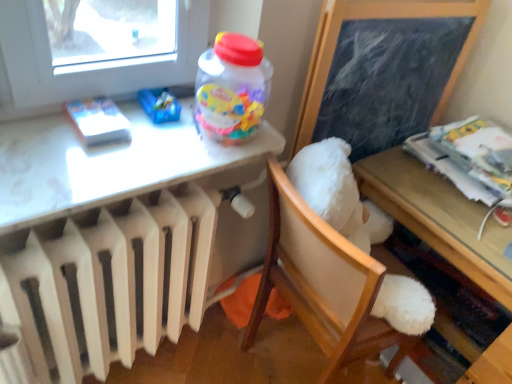
What do you see at coordinates (460, 161) in the screenshot? I see `printed paper stack at right, which is the second magazine in front-to-back order` at bounding box center [460, 161].

Where is `white plush chair at center`? white plush chair at center is located at coordinates (322, 283).

What is the approximate width of white matte book at upper left, placed as the 2th magazine when sorted from right to left?

white matte book at upper left, placed as the 2th magazine when sorted from right to left, is 6.42 inches wide.

What is the approximate height of black chalkboard at upper right?

The height of black chalkboard at upper right is 51.75 centimeters.

Describe the element at coordinates (108, 232) in the screenshot. I see `white plastic radiator at lower left` at that location.

The width and height of the screenshot is (512, 384). What are the coordinates of `white plastic radiator at lower left` in the screenshot? It's located at [x=108, y=232].

From the picture: How much space does white glossy table at upper left, which appears as the 2th table when viewed from the right, occupy vertically?

The height of white glossy table at upper left, which appears as the 2th table when viewed from the right, is 2.96 inches.

Locate an element on the screen. This screenshot has width=512, height=384. white glossy table at upper left, which ranks as the first table in left-to-right order is located at coordinates (106, 163).

This screenshot has height=384, width=512. I want to click on wooden table at lower right, the 1th table viewed from the right, so click(435, 215).

Locate an element on the screen. printed paper stack at right, placed as the second magazine when sorted from left to right is located at coordinates pos(460,161).

Is white matte book at upper left, marked as the first magazine in a front-to-back arrangement, thinner than white plastic radiator at lower left?

Indeed, white matte book at upper left, marked as the first magazine in a front-to-back arrangement, has a lesser width compared to white plastic radiator at lower left.

Which point is more forward, (x=105, y=101) or (x=6, y=314)?

The point (x=6, y=314) is closer to the camera.

Is white matte book at upper left, placed as the 1th magazine when sorted from left to right, far away from white plastic radiator at lower left?

white matte book at upper left, placed as the 1th magazine when sorted from left to right, is near white plastic radiator at lower left, not far away.

From a real-world perspective, does white matte book at upper left, placed as the 2th magazine when sorted from right to left, sit lower than white plastic radiator at lower left?

Actually, white matte book at upper left, placed as the 2th magazine when sorted from right to left, is physically above white plastic radiator at lower left in the real world.

Is white plastic radiator at lower left positioned with its back to white plush chair at center?

No, white plastic radiator at lower left is not facing away from white plush chair at center.

Can you see white plastic radiator at lower left touching white plush chair at center?

No, white plastic radiator at lower left is not next to white plush chair at center.

Considering the relative positions of white plastic radiator at lower left and white plush chair at center in the image provided, is white plastic radiator at lower left to the left or to the right of white plush chair at center?

In the image, white plastic radiator at lower left appears on the left side of white plush chair at center.

From the image's perspective, between white plastic radiator at lower left and white plush chair at center, which one is located above?

white plush chair at center, from the image's perspective.

How many degrees apart are the facing directions of white glossy table at upper left, which ranks as the first table in left-to-right order, and white plush chair at center?

There is a 90-degree angle between the facing directions of white glossy table at upper left, which ranks as the first table in left-to-right order, and white plush chair at center.

Is there a large distance between white glossy table at upper left, which ranks as the first table in left-to-right order, and white plush chair at center?

They are positioned close to each other.

Can we say white glossy table at upper left, which ranks as the first table in left-to-right order, lies outside white plush chair at center?

Yes.

Is point (2, 160) positioned in front of point (270, 259)?

Yes, point (2, 160) is in front of point (270, 259).

Can you confirm if white glossy table at upper left, which appears as the 2th table when viewed from the right, is wider than black chalkboard at upper right?

Correct, the width of white glossy table at upper left, which appears as the 2th table when viewed from the right, exceeds that of black chalkboard at upper right.

Does point (121, 162) come closer to viewer compared to point (447, 62)?

Yes.

Is white glossy table at upper left, which ranks as the first table in left-to-right order, turned away from black chalkboard at upper right?

No, white glossy table at upper left, which ranks as the first table in left-to-right order, is not facing the opposite direction of black chalkboard at upper right.

From the image's perspective, would you say printed paper stack at right, which ranks as the first magazine in right-to-left order, is positioned over white plush chair at center?

Yes, from the image's perspective, printed paper stack at right, which ranks as the first magazine in right-to-left order, is over white plush chair at center.

Considering the relative sizes of printed paper stack at right, placed as the second magazine when sorted from left to right, and white plush chair at center in the image provided, is printed paper stack at right, placed as the second magazine when sorted from left to right, smaller than white plush chair at center?

Yes.

Based on their positions, is printed paper stack at right, which ranks as the first magazine in right-to-left order, located to the left or right of white plush chair at center?

printed paper stack at right, which ranks as the first magazine in right-to-left order, is to the right of white plush chair at center.

Is printed paper stack at right, which is the second magazine in front-to-back order, further to camera compared to white plush chair at center?

Yes, printed paper stack at right, which is the second magazine in front-to-back order, is further from the camera.

From the image's perspective, is printed paper stack at right, which is the second magazine in front-to-back order, located above or below white glossy table at upper left, which appears as the 2th table when viewed from the right?

Based on their image positions, printed paper stack at right, which is the second magazine in front-to-back order, is located above white glossy table at upper left, which appears as the 2th table when viewed from the right.

Does point (502, 194) appear closer or farther from the camera than point (63, 175)?

Point (502, 194) appears to be farther away from the viewer than point (63, 175).

In the image, is printed paper stack at right, which is the second magazine in front-to-back order, on the left side or the right side of white glossy table at upper left, which appears as the 2th table when viewed from the right?

From the image, it's evident that printed paper stack at right, which is the second magazine in front-to-back order, is to the right of white glossy table at upper left, which appears as the 2th table when viewed from the right.

Is printed paper stack at right, which ranks as the first magazine in right-to-left order, wider than white glossy table at upper left, which appears as the 2th table when viewed from the right?

Yes.

From the image's perspective, would you say printed paper stack at right, which ranks as the 1th magazine in back-to-front order, is positioned over white matte book at upper left, the 2th magazine from the back?

No, from the image's perspective, printed paper stack at right, which ranks as the 1th magazine in back-to-front order, is not on top of white matte book at upper left, the 2th magazine from the back.

What's the angular difference between printed paper stack at right, which is the second magazine in front-to-back order, and white matte book at upper left, placed as the 1th magazine when sorted from left to right,'s facing directions?

They differ by 88.9 degrees in their facing directions.

From a real-world perspective, which object stands above the other?

white matte book at upper left, the 2th magazine from the back, is physically above.

This screenshot has width=512, height=384. What are the coordinates of `magazine on the left of printed paper stack at right, which ranks as the first magazine in right-to-left order` in the screenshot? It's located at (98, 121).

Which magazine is the 1st one when counting from the right side of the white plastic radiator at lower left? Please provide its 2D coordinates.

[(98, 121)]

Where is `chair in front of the white plastic radiator at lower left`? The height and width of the screenshot is (384, 512). chair in front of the white plastic radiator at lower left is located at coordinates pos(322,283).

Estimate the real-world distances between objects in this image. Which object is further from printed paper stack at right, which ranks as the first magazine in right-to-left order, white plastic radiator at lower left or wooden table at lower right, the 1th table viewed from the right?

white plastic radiator at lower left is further to printed paper stack at right, which ranks as the first magazine in right-to-left order.

Estimate the real-world distances between objects in this image. Which object is further from wooden table at lower right, which appears as the 2th table when viewed from the left, white plush chair at center or white matte book at upper left, placed as the 2th magazine when sorted from right to left?

white matte book at upper left, placed as the 2th magazine when sorted from right to left, is positioned further to the anchor wooden table at lower right, which appears as the 2th table when viewed from the left.

Considering their positions, is wooden table at lower right, the 1th table viewed from the right, positioned closer to printed paper stack at right, which is the second magazine in front-to-back order, than white plush chair at center?

wooden table at lower right, the 1th table viewed from the right, is positioned closer to the anchor printed paper stack at right, which is the second magazine in front-to-back order.

Looking at the image, which one is located further to wooden table at lower right, the 1th table viewed from the right, white glossy table at upper left, which ranks as the first table in left-to-right order, or white matte book at upper left, placed as the 2th magazine when sorted from right to left?

Based on the image, white matte book at upper left, placed as the 2th magazine when sorted from right to left, appears to be further to wooden table at lower right, the 1th table viewed from the right.

When comparing their distances from white plush chair at center, does black chalkboard at upper right or white plastic radiator at lower left seem further?

black chalkboard at upper right is further to white plush chair at center.

Considering their positions, is white matte book at upper left, placed as the 1th magazine when sorted from left to right, positioned closer to white plush chair at center than wooden table at lower right, the 1th table viewed from the right?

wooden table at lower right, the 1th table viewed from the right, lies closer to white plush chair at center than the other object.

When comparing their distances from black chalkboard at upper right, does white matte book at upper left, placed as the 2th magazine when sorted from right to left, or white plush chair at center seem further?

white matte book at upper left, placed as the 2th magazine when sorted from right to left, is positioned further to the anchor black chalkboard at upper right.

Estimate the real-world distances between objects in this image. Which object is further from white plastic radiator at lower left, white matte book at upper left, placed as the 1th magazine when sorted from left to right, or white glossy table at upper left, which ranks as the first table in left-to-right order?

white matte book at upper left, placed as the 1th magazine when sorted from left to right, lies further to white plastic radiator at lower left than the other object.

Find the location of a particular element. Image resolution: width=512 pixels, height=384 pixels. bulletin board located between white plastic radiator at lower left and printed paper stack at right, placed as the second magazine when sorted from left to right, in the left-right direction is located at coordinates (384, 69).

The width and height of the screenshot is (512, 384). Identify the location of bulletin board between white glossy table at upper left, which appears as the 2th table when viewed from the right, and wooden table at lower right, which appears as the 2th table when viewed from the left. (384, 69).

The image size is (512, 384). I want to click on magazine situated between white plastic radiator at lower left and white plush chair at center from left to right, so click(x=98, y=121).

I want to click on bulletin board situated between white matte book at upper left, marked as the first magazine in a front-to-back arrangement, and printed paper stack at right, which is the second magazine in front-to-back order, from left to right, so click(384, 69).